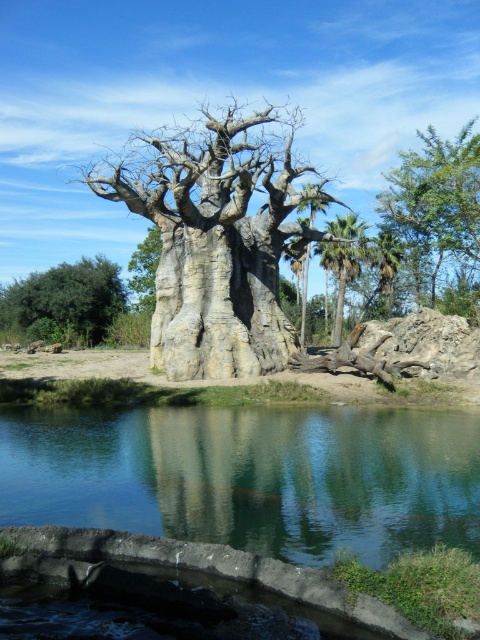
Consider the image. You are standing at the edge of the water in the scene and want to walk towards the tree. Which point, point (344, 232) or point (382, 275), is closer to you?

Point (344, 232) is closer to you because it is in front of point (382, 275).